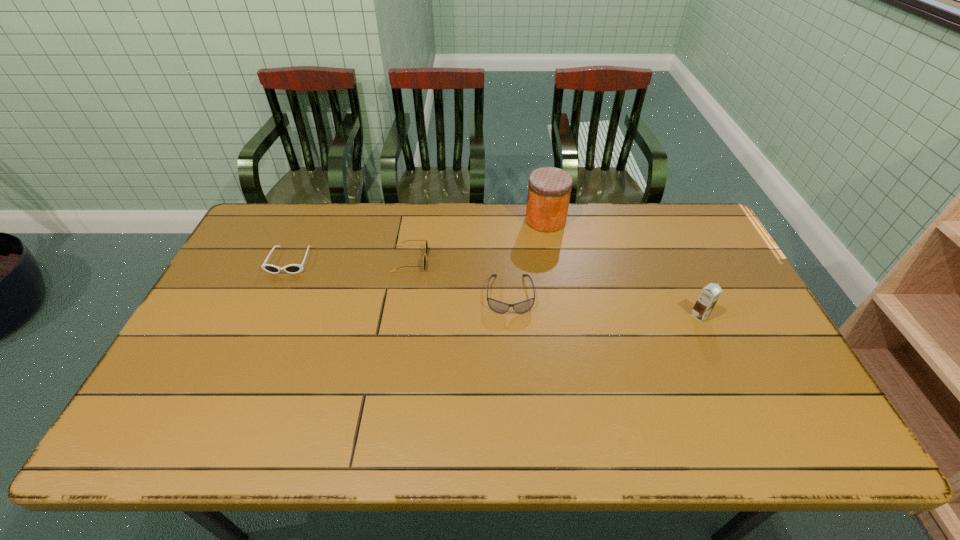
In order to click on vacant space at the far right corner of the desktop in this screenshot , I will do `click(657, 212)`.

Where is `unoccupied area between the leftmost sunglasses and the second sunglasses from left to right`? unoccupied area between the leftmost sunglasses and the second sunglasses from left to right is located at coordinates (350, 260).

Where is `vacant space that's between the nearest sunglasses and the chocolate milk`? This screenshot has height=540, width=960. vacant space that's between the nearest sunglasses and the chocolate milk is located at coordinates click(x=605, y=305).

You are a GUI agent. You are given a task and a screenshot of the screen. Output one action in this format:
    pyautogui.click(x=<x>, y=<y>)
    Task: Click on the empty space between the fourth object from left to right and the leftmost sunglasses
    The width and height of the screenshot is (960, 540).
    Given the screenshot: What is the action you would take?
    pyautogui.click(x=418, y=240)

You are a GUI agent. You are given a task and a screenshot of the screen. Output one action in this format:
    pyautogui.click(x=<x>, y=<y>)
    Task: Click on the vacant space that's between the rightmost sunglasses and the fourth object from right to left
    
    Given the screenshot: What is the action you would take?
    pyautogui.click(x=460, y=278)

This screenshot has height=540, width=960. Identify the location of vacant area that lies between the second sunglasses from right to left and the third object from left to right. [x=460, y=278].

Identify the location of free space between the second object from left to right and the third object from right to left. (460, 278).

Find the location of `free spot between the fourth object from right to left and the third object from left to right`. free spot between the fourth object from right to left and the third object from left to right is located at coordinates pos(460,278).

Find the location of a particular element. Image resolution: width=960 pixels, height=540 pixels. vacant space in between the second object from right to left and the chocolate milk is located at coordinates (622, 268).

I want to click on free space between the third object from left to right and the second sunglasses from right to left, so click(460, 278).